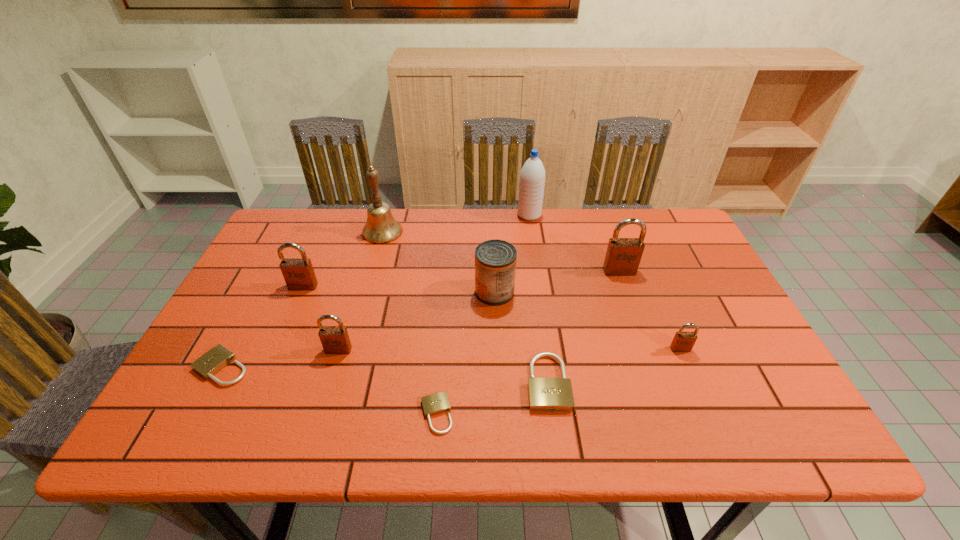
Find the location of `beige padlock that is the third closest to the smallest brown padlock`. beige padlock that is the third closest to the smallest brown padlock is located at coordinates (214, 360).

Locate an element on the screen. vacant area in the image that satisfies the following two spatial constraints: 1. on the front-facing side of the second tallest padlock; 2. on the left side of the red can is located at coordinates pyautogui.click(x=300, y=292).

The height and width of the screenshot is (540, 960). Find the location of `free spot that satisfies the following two spatial constraints: 1. on the front side of the third shortest padlock; 2. on the left side of the leftmost padlock`. free spot that satisfies the following two spatial constraints: 1. on the front side of the third shortest padlock; 2. on the left side of the leftmost padlock is located at coordinates (214, 382).

Identify the location of free space that satisfies the following two spatial constraints: 1. on the back side of the biggest beige padlock; 2. on the right side of the smallest beige padlock. Image resolution: width=960 pixels, height=540 pixels. (439, 382).

In order to click on vacant area in the image that satisfies the following two spatial constraints: 1. on the back side of the bell; 2. on the left side of the leftmost padlock in this screenshot , I will do `click(294, 232)`.